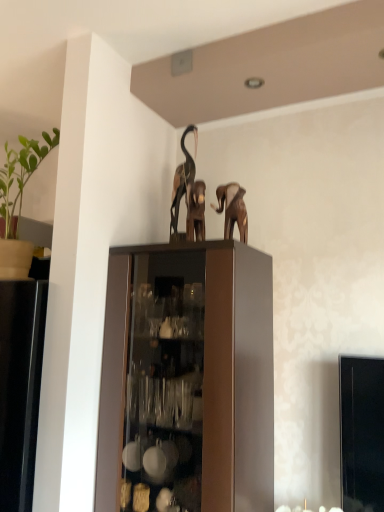
The image size is (384, 512). Describe the element at coordinates (195, 210) in the screenshot. I see `wooden elephant at center, the second animal from the back` at that location.

What do you see at coordinates (188, 195) in the screenshot?
I see `metallic brown elephant at upper center, which is the 1th animal in back-to-front order` at bounding box center [188, 195].

Locate an element on the screen. This screenshot has width=384, height=512. green matte plant at left is located at coordinates (19, 202).

Is wooden elephant at center, which is the first animal in front-to-back order, next to metallic brown elephant at upper center, marked as the second animal in a front-to-back arrangement, and touching it?

They are not placed beside each other.

Which is farther from the camera, [190,220] or [178,175]?

The point [178,175] is behind.

Does wooden elephant at center, which is the first animal in front-to-back order, have a larger size compared to metallic brown elephant at upper center, which is the 1th animal in back-to-front order?

Actually, wooden elephant at center, which is the first animal in front-to-back order, might be smaller than metallic brown elephant at upper center, which is the 1th animal in back-to-front order.

How different are the orientations of green matte plant at left and wooden elephant at center, the second animal from the back, in degrees?

The angular difference between green matte plant at left and wooden elephant at center, the second animal from the back, is 38 degrees.

Which is more to the right, green matte plant at left or wooden elephant at center, the second animal from the back?

wooden elephant at center, the second animal from the back, is more to the right.

From a real-world perspective, which object stands above the other?

green matte plant at left.

In the scene shown: Considering the relative sizes of green matte plant at left and wooden elephant at center, the second animal from the back, in the image provided, is green matte plant at left bigger than wooden elephant at center, the second animal from the back,?

Yes, green matte plant at left is bigger than wooden elephant at center, the second animal from the back.

Could you measure the distance between wooden elephant at center, the second animal from the back, and green matte plant at left?

29.98 inches.

Do you think wooden elephant at center, the second animal from the back, is within green matte plant at left, or outside of it?

wooden elephant at center, the second animal from the back, cannot be found inside green matte plant at left.

Is wooden elephant at center, the second animal from the back, turned away from green matte plant at left?

No, wooden elephant at center, the second animal from the back, is not facing the opposite direction of green matte plant at left.

What are the coordinates of `animal below the green matte plant at left (from the image's perspective)` in the screenshot? It's located at (195, 210).

Which of these two, metallic brown elephant at upper center, which is the 1th animal in back-to-front order, or green matte plant at left, is wider?

green matte plant at left.

Is metallic brown elephant at upper center, marked as the second animal in a front-to-back arrangement, not close to green matte plant at left?

No, metallic brown elephant at upper center, marked as the second animal in a front-to-back arrangement, is not far away from green matte plant at left.

Is metallic brown elephant at upper center, marked as the second animal in a front-to-back arrangement, not inside green matte plant at left?

Indeed, metallic brown elephant at upper center, marked as the second animal in a front-to-back arrangement, is completely outside green matte plant at left.

Which animal is the 1st one when counting from the right side of the green matte plant at left? Please provide its 2D coordinates.

[(188, 195)]

Measure the distance from green matte plant at left to brown matte elephant at upper center.

green matte plant at left is 86.41 centimeters away from brown matte elephant at upper center.

Is point (18, 191) closer to viewer compared to point (232, 236)?

That is False.

Considering the sizes of objects green matte plant at left and brown matte elephant at upper center in the image provided, who is smaller, green matte plant at left or brown matte elephant at upper center?

brown matte elephant at upper center is smaller.

Is green matte plant at left oriented towards brown matte elephant at upper center?

Result: No, green matte plant at left does not turn towards brown matte elephant at upper center.

Between metallic brown elephant at upper center, which is the 1th animal in back-to-front order, and brown matte elephant at upper center, which one has more height?

Standing taller between the two is metallic brown elephant at upper center, which is the 1th animal in back-to-front order.

Is metallic brown elephant at upper center, marked as the second animal in a front-to-back arrangement, closer to camera compared to brown matte elephant at upper center?

No, metallic brown elephant at upper center, marked as the second animal in a front-to-back arrangement, is further to the viewer.

Is metallic brown elephant at upper center, marked as the second animal in a front-to-back arrangement, wider or thinner than brown matte elephant at upper center?

In the image, metallic brown elephant at upper center, marked as the second animal in a front-to-back arrangement, appears to be wider than brown matte elephant at upper center.

From a real-world perspective, is metallic brown elephant at upper center, which is the 1th animal in back-to-front order, on top of brown matte elephant at upper center?

Indeed, from a real-world perspective, metallic brown elephant at upper center, which is the 1th animal in back-to-front order, stands above brown matte elephant at upper center.

Can we say brown matte elephant at upper center lies outside wooden elephant at center, which is the first animal in front-to-back order?

brown matte elephant at upper center lies outside wooden elephant at center, which is the first animal in front-to-back order,'s area.

Based on the photo, considering the sizes of objects brown matte elephant at upper center and wooden elephant at center, which is the first animal in front-to-back order, in the image provided, who is smaller, brown matte elephant at upper center or wooden elephant at center, which is the first animal in front-to-back order,?

With smaller size is wooden elephant at center, which is the first animal in front-to-back order.

This screenshot has width=384, height=512. Identify the location of elephant that is behind the wooden elephant at center, which is the first animal in front-to-back order. (232, 210).

There is a wooden elephant at center, which is the first animal in front-to-back order. Where is `animal above it (from a real-world perspective)`? animal above it (from a real-world perspective) is located at coordinates (188, 195).

What are the coordinates of `houseplant located on the left of wooden elephant at center, which is the first animal in front-to-back order` in the screenshot? It's located at (19, 202).

In the scene shown: From the image, which object appears to be nearer to wooden elephant at center, which is the first animal in front-to-back order, green matte plant at left or metallic brown elephant at upper center, which is the 1th animal in back-to-front order?

Among the two, metallic brown elephant at upper center, which is the 1th animal in back-to-front order, is located nearer to wooden elephant at center, which is the first animal in front-to-back order.

When comparing their distances from brown matte elephant at upper center, does metallic brown elephant at upper center, marked as the second animal in a front-to-back arrangement, or wooden elephant at center, the second animal from the back, seem closer?

Based on the image, wooden elephant at center, the second animal from the back, appears to be nearer to brown matte elephant at upper center.

Estimate the real-world distances between objects in this image. Which object is closer to green matte plant at left, metallic brown elephant at upper center, which is the 1th animal in back-to-front order, or brown matte elephant at upper center?

metallic brown elephant at upper center, which is the 1th animal in back-to-front order, is closer to green matte plant at left.

Looking at the image, which one is located further to metallic brown elephant at upper center, which is the 1th animal in back-to-front order, green matte plant at left or brown matte elephant at upper center?

Based on the image, green matte plant at left appears to be further to metallic brown elephant at upper center, which is the 1th animal in back-to-front order.

Estimate the real-world distances between objects in this image. Which object is further from wooden elephant at center, the second animal from the back, green matte plant at left or brown matte elephant at upper center?

Based on the image, green matte plant at left appears to be further to wooden elephant at center, the second animal from the back.

Based on the photo, estimate the real-world distances between objects in this image. Which object is closer to metallic brown elephant at upper center, which is the 1th animal in back-to-front order, green matte plant at left or wooden elephant at center, which is the first animal in front-to-back order?

wooden elephant at center, which is the first animal in front-to-back order, is closer to metallic brown elephant at upper center, which is the 1th animal in back-to-front order.

Based on the photo, based on their spatial positions, is wooden elephant at center, the second animal from the back, or brown matte elephant at upper center closer to green matte plant at left?

wooden elephant at center, the second animal from the back, lies closer to green matte plant at left than the other object.

Considering their positions, is brown matte elephant at upper center positioned further to metallic brown elephant at upper center, marked as the second animal in a front-to-back arrangement, than wooden elephant at center, the second animal from the back?

brown matte elephant at upper center is further to metallic brown elephant at upper center, marked as the second animal in a front-to-back arrangement.

This screenshot has height=512, width=384. In order to click on elephant positioned between wooden elephant at center, the second animal from the back, and metallic brown elephant at upper center, marked as the second animal in a front-to-back arrangement, from near to far in this screenshot , I will do `click(232, 210)`.

You are a GUI agent. You are given a task and a screenshot of the screen. Output one action in this format:
    pyautogui.click(x=<x>, y=<y>)
    Task: Click on the animal between green matte plant at left and wooden elephant at center, which is the first animal in front-to-back order, in the horizontal direction
    Image resolution: width=384 pixels, height=512 pixels.
    Given the screenshot: What is the action you would take?
    pyautogui.click(x=188, y=195)